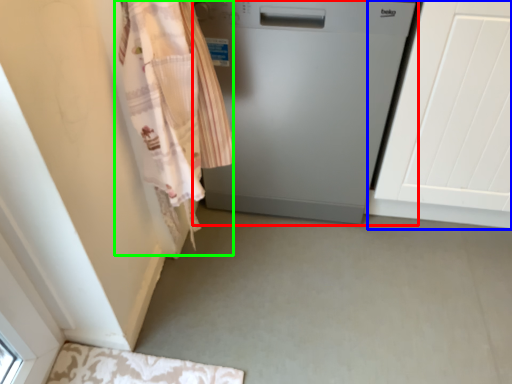
Question: Which object is positioned farthest from home appliance (highlighted by a red box)? Select from screen door (highlighted by a blue box) and clothing (highlighted by a green box).

Choices:
 (A) screen door
 (B) clothing

Answer: (B)